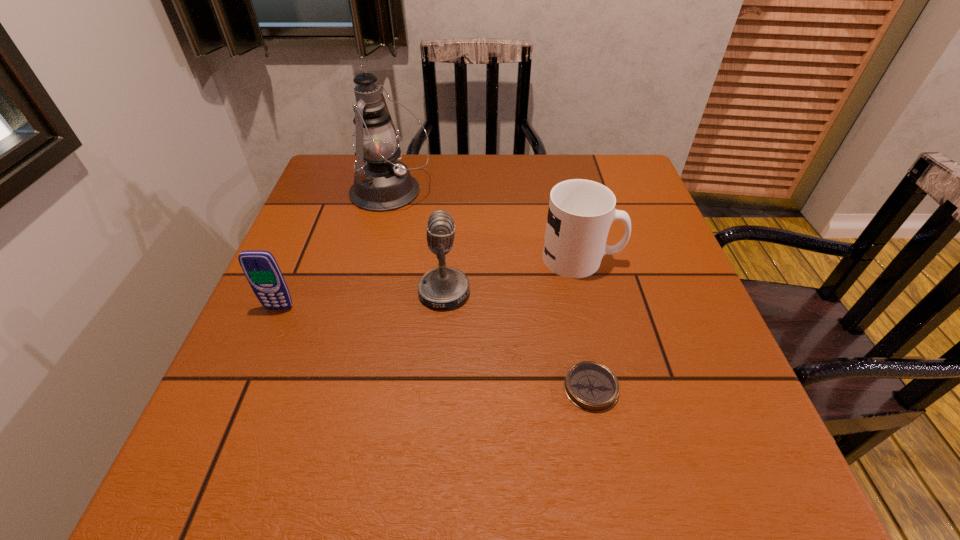
Identify the location of the fourth object from right to left. (382, 184).

Where is `the farthest object`? The width and height of the screenshot is (960, 540). the farthest object is located at coordinates (382, 184).

Locate an element on the screen. This screenshot has height=540, width=960. microphone is located at coordinates (445, 287).

Image resolution: width=960 pixels, height=540 pixels. In order to click on the fourth shortest object in this screenshot , I will do `click(445, 287)`.

This screenshot has height=540, width=960. What are the coordinates of `mug` in the screenshot? It's located at (580, 214).

Find the location of a particular element. Image resolution: width=960 pixels, height=540 pixels. cellular telephone is located at coordinates (261, 269).

Locate an element on the screen. Image resolution: width=960 pixels, height=540 pixels. the shortest object is located at coordinates (591, 386).

The width and height of the screenshot is (960, 540). What are the coordinates of `the nearest object` in the screenshot? It's located at (591, 386).

This screenshot has width=960, height=540. I want to click on free region located on the right of the farthest object, so click(523, 192).

I want to click on vacant space located 0.340m on the front-facing side of the third object from left to right, so click(636, 293).